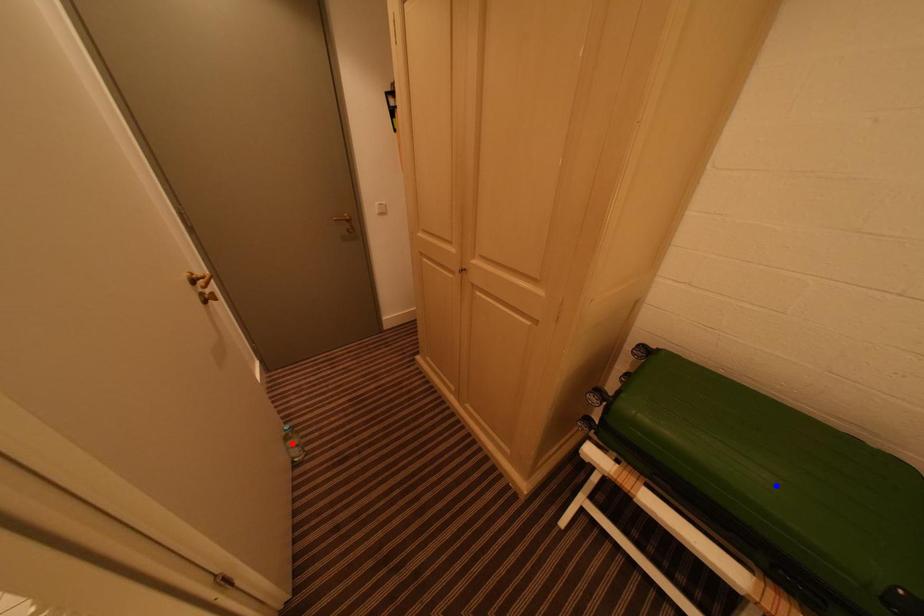
Question: Which of the two points in the image is closer to the camera?

Choices:
 (A) Blue point is closer.
 (B) Red point is closer.

Answer: (A)